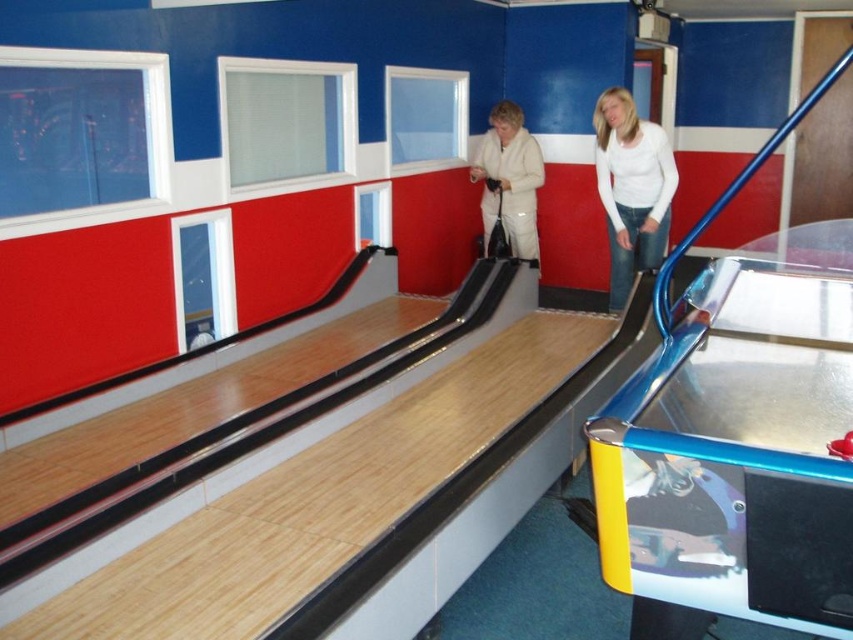
You are a photographer planning to take a photo of both the white matte shirt at upper right and the white fleece jacket at center. Since both are white, you want to ensure they are distinguishable in the image. Which clothing item should you focus on first to ensure it appears larger in the photo?

The white matte shirt at upper right should be focused on first because it is taller than the white fleece jacket at center, making it naturally larger in the photo.

You are a photographer positioned at the end of the bowling lane. You need to capture both the white matte shirt at upper right and the white fleece jacket at center in your shot. Which of the two is nearer to your camera?

The white matte shirt at upper right is closer to the viewer than the white fleece jacket at center, so it will appear nearer in the photograph.